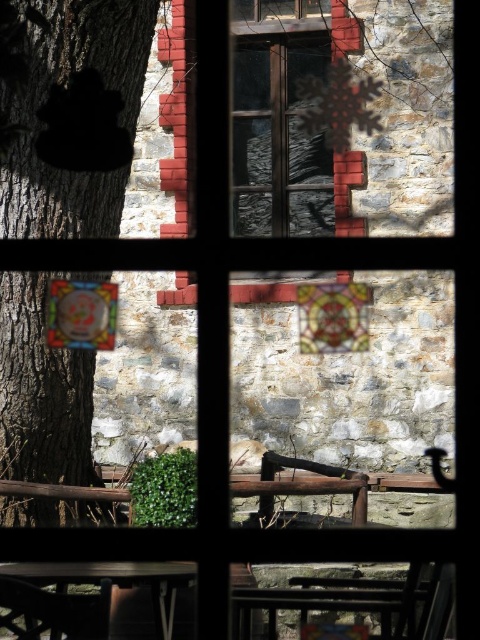
Does brown rough bark at lower left appear on the right side of wooden table at lower left?

No, brown rough bark at lower left is not to the right of wooden table at lower left.

Which is in front, point (84, 396) or point (173, 592)?

Positioned in front is point (173, 592).

The image size is (480, 640). Identify the location of brown rough bark at lower left. (73, 112).

Can you confirm if brown rough bark at lower left is smaller than wooden chair at lower left?

No.

Does brown rough bark at lower left come in front of wooden chair at lower left?

No.

The width and height of the screenshot is (480, 640). What do you see at coordinates (73, 112) in the screenshot?
I see `brown rough bark at lower left` at bounding box center [73, 112].

Where is `brown rough bark at lower left`? The image size is (480, 640). brown rough bark at lower left is located at coordinates (73, 112).

Who is higher up, wooden table at lower left or wooden chair at lower left?

wooden chair at lower left is higher up.

What are the coordinates of `wooden table at lower left` in the screenshot? It's located at (115, 580).

This screenshot has height=640, width=480. I want to click on wooden table at lower left, so click(115, 580).